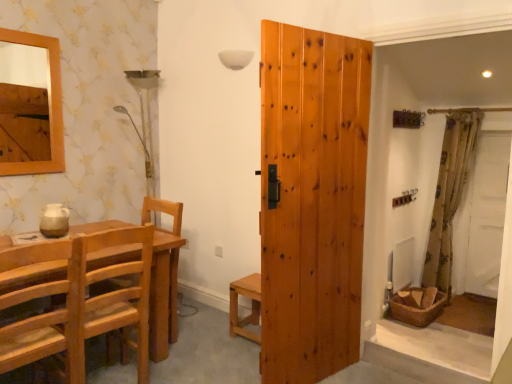
The width and height of the screenshot is (512, 384). In order to click on empty space that is in between light brown wooden stool at center and natural wood chair at left in this screenshot , I will do point(206,334).